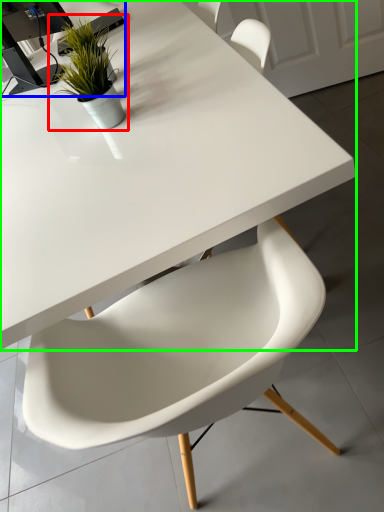
Question: Estimate the real-world distances between objects in this image. Which object is closer to houseplant (highlighted by a red box), computer desk (highlighted by a blue box) or table (highlighted by a green box)?

Choices:
 (A) computer desk
 (B) table

Answer: (B)